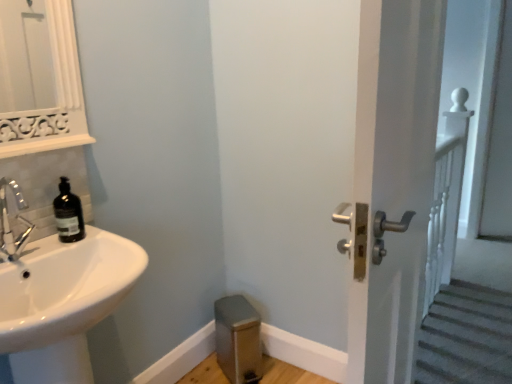
Question: From a real-world perspective, relative to matte black soap dispenser at left, is white glossy sink at lower left vertically above or below?

Choices:
 (A) below
 (B) above

Answer: (A)

Question: Would you say white glossy sink at lower left is to the left or to the right of matte black soap dispenser at left in the picture?

Choices:
 (A) right
 (B) left

Answer: (A)

Question: Which object is the farthest from the brushed metal step stool at lower center?

Choices:
 (A) white glossy door handle at right
 (B) matte black soap dispenser at left
 (C) white glossy sink at lower left

Answer: (A)

Question: Which of these objects is positioned closest to the brushed metal step stool at lower center?

Choices:
 (A) white glossy sink at lower left
 (B) white glossy door handle at right
 (C) matte black soap dispenser at left

Answer: (A)